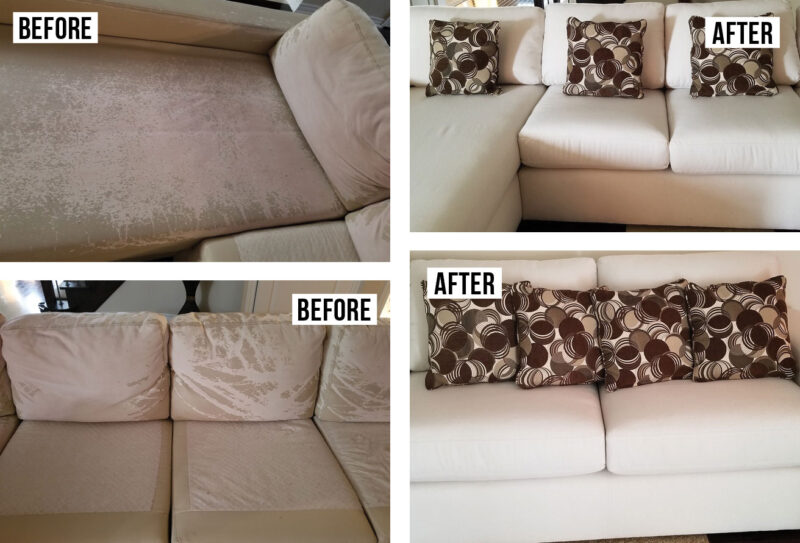
The height and width of the screenshot is (543, 800). I want to click on middle of couch, so click(x=604, y=466).